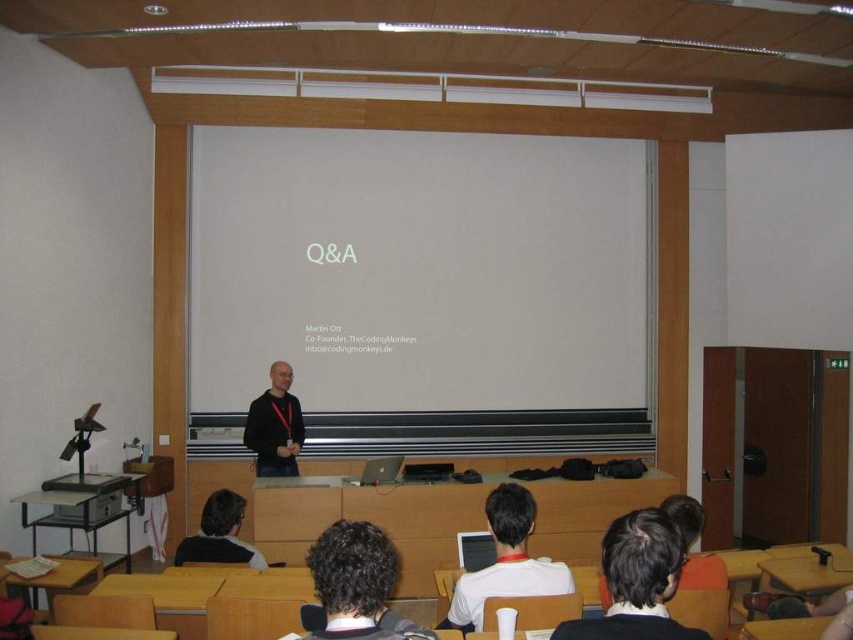
You are a student sitting in the classroom and need to place your white matte laptop at lower center on top of the black matte shirt at center. Will the laptop fit without overlapping the shirt?

The white matte laptop at lower center is wider than the black matte shirt at center, so placing it on top would cause overlapping since the laptop is wider than the shirt.

You are a photographer standing at the camera position. You want to take a photo of the point at coordinate (x=238, y=308). The focus range of your camera is set to 5 meters. Will the point be in focus?

The point at coordinate (x=238, y=308) is 6.17 meters from the camera. Since the focus range is set to 5 meters, the point is beyond the focus range and will not be in focus.

You are sitting at a desk in the classroom and want to check your laptop. Which object at point (x=505, y=561) is your laptop?

The white matte laptop at lower center is located at point (x=505, y=561).